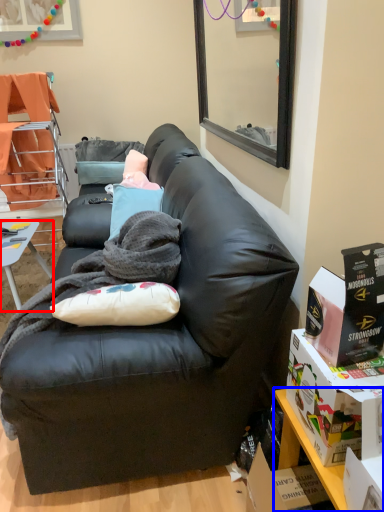
Question: Which object appears farthest to the camera in this image, desk (highlighted by a red box) or table (highlighted by a blue box)?

Choices:
 (A) desk
 (B) table

Answer: (A)